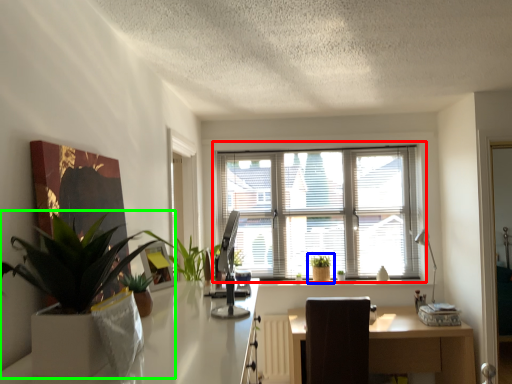
Question: Considering the real-world distances, which object is closest to window (highlighted by a red box)? houseplant (highlighted by a blue box) or houseplant (highlighted by a green box).

Choices:
 (A) houseplant
 (B) houseplant

Answer: (A)